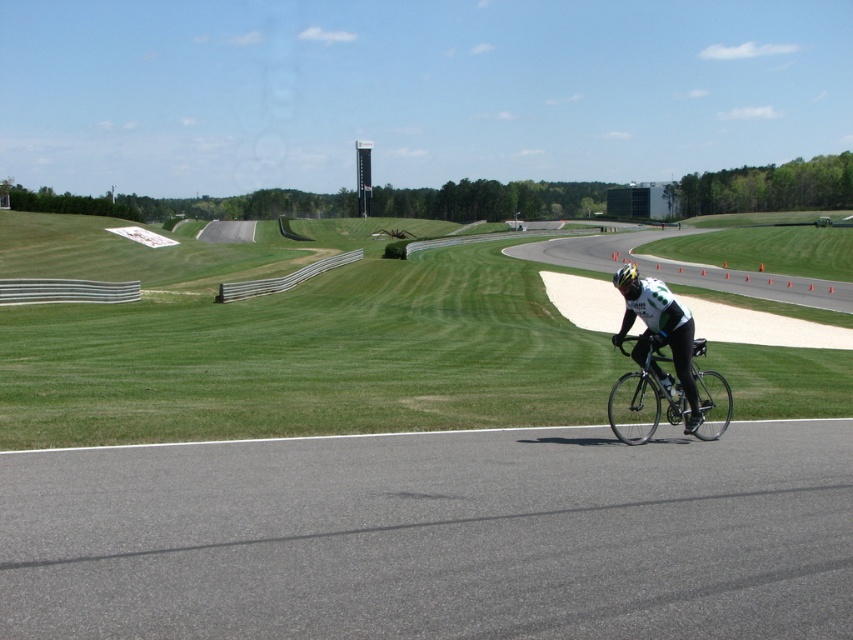
Is green grass at center behind white matte bicycle helmet at center?

No, it is in front of white matte bicycle helmet at center.

This screenshot has width=853, height=640. In order to click on green grass at center in this screenshot , I will do `click(283, 342)`.

Where is `green grass at center`? The width and height of the screenshot is (853, 640). green grass at center is located at coordinates (283, 342).

Between green grass at center and green jersey at center, which one appears on the left side from the viewer's perspective?

Positioned to the left is green grass at center.

Find the location of a particular element. The image size is (853, 640). green grass at center is located at coordinates (283, 342).

Between point (685, 388) and point (628, 282), which one is positioned behind?

Point (685, 388)

Who is more distant from viewer, (674, 301) or (618, 285)?

Point (618, 285)

Locate an element on the screen. green jersey at center is located at coordinates (659, 330).